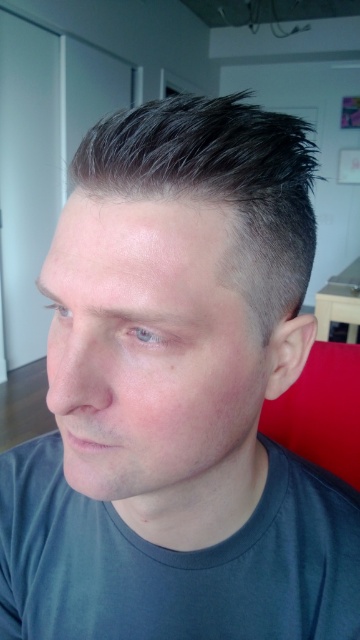
Question: Where is smooth skin head at center located in relation to dark gray cotton t-shirt at lower center in the image?

Choices:
 (A) right
 (B) left

Answer: (A)

Question: Which point is closer to the camera taking this photo?

Choices:
 (A) (241, 310)
 (B) (75, 500)

Answer: (A)

Question: Is smooth skin head at center below dark gray cotton t-shirt at lower center?

Choices:
 (A) no
 (B) yes

Answer: (A)

Question: Can you confirm if smooth skin head at center is bigger than dark gray cotton t-shirt at lower center?

Choices:
 (A) yes
 (B) no

Answer: (A)

Question: Which point is closer to the camera taking this photo?

Choices:
 (A) (138, 317)
 (B) (2, 596)

Answer: (A)

Question: Among these objects, which one is nearest to the camera?

Choices:
 (A) dark gray cotton t-shirt at lower center
 (B) smooth skin head at center

Answer: (B)